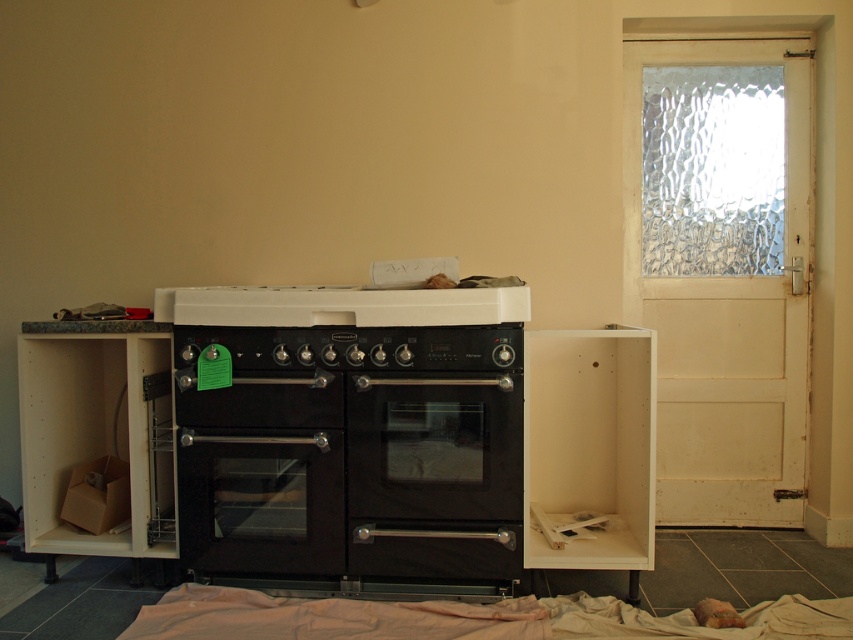
Question: Which of the following is the closest to the observer?

Choices:
 (A) black matte stove at center
 (B) black matte oven at center

Answer: (A)

Question: Which point is closer to the camera taking this photo?

Choices:
 (A) (221, 449)
 (B) (461, 310)

Answer: (B)

Question: Is black matte oven at center bigger than black matte stove at center?

Choices:
 (A) yes
 (B) no

Answer: (A)

Question: Does black matte oven at center lie in front of black matte stove at center?

Choices:
 (A) yes
 (B) no

Answer: (B)

Question: Which point is closer to the camera taking this photo?

Choices:
 (A) (345, 317)
 (B) (271, 380)

Answer: (B)

Question: Is black matte oven at center closer to the viewer compared to black matte stove at center?

Choices:
 (A) no
 (B) yes

Answer: (A)